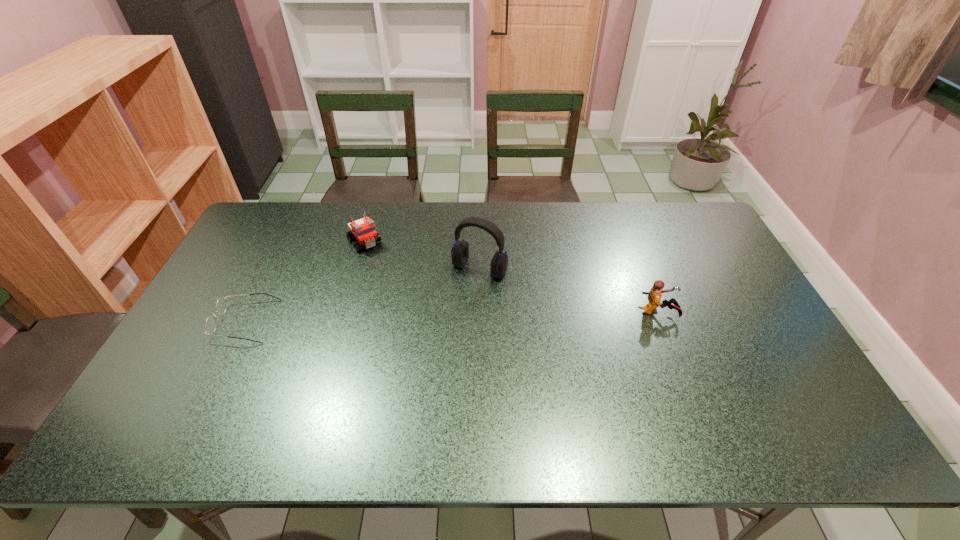
Where is `free region located 0.300m on the front-facing side of the left Lego`? free region located 0.300m on the front-facing side of the left Lego is located at coordinates (415, 308).

Find the location of a particular element. The width and height of the screenshot is (960, 540). vacant space located 0.330m on the front-facing side of the left Lego is located at coordinates (420, 314).

This screenshot has height=540, width=960. What are the coordinates of `free space located on the headband of the tallest object` in the screenshot? It's located at (413, 367).

The height and width of the screenshot is (540, 960). What are the coordinates of `blank space located 0.360m on the headband of the tallest object` in the screenshot? It's located at (409, 374).

You are a GUI agent. You are given a task and a screenshot of the screen. Output one action in this format:
    pyautogui.click(x=<x>, y=<y>)
    Task: Click on the free space located on the headband of the tallest object
    Image resolution: width=960 pixels, height=540 pixels.
    Given the screenshot: What is the action you would take?
    point(433,336)

The height and width of the screenshot is (540, 960). In order to click on object situated at the far edge in this screenshot , I will do `click(364, 229)`.

At what (x,y) coordinates should I click in order to perform the action: click on object located in the left edge section of the desktop. Please return your answer as a coordinate pair (x, y). This screenshot has width=960, height=540. Looking at the image, I should click on (221, 305).

I want to click on vacant space at the far edge of the desktop, so pos(536,216).

This screenshot has height=540, width=960. In the image, there is a desktop. In order to click on vacant space at the near edge in this screenshot , I will do `click(490, 383)`.

Identify the location of free space at the right edge. (775, 344).